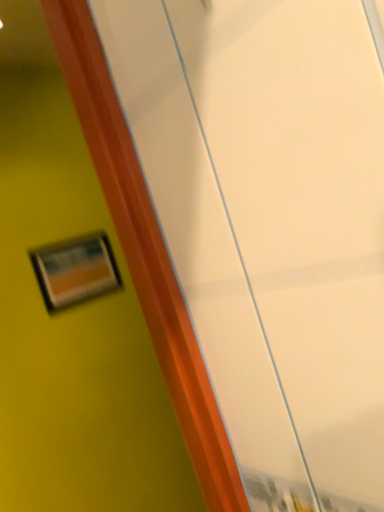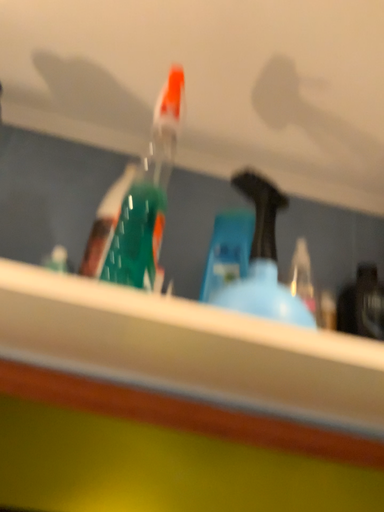
Question: Which way did the camera rotate in the video?

Choices:
 (A) rotated downward
 (B) rotated upward

Answer: (B)